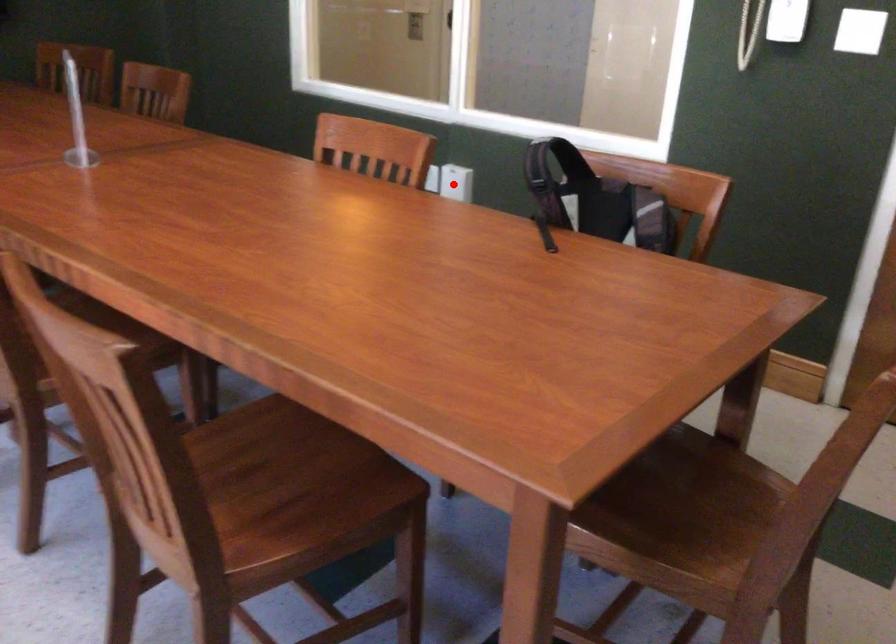
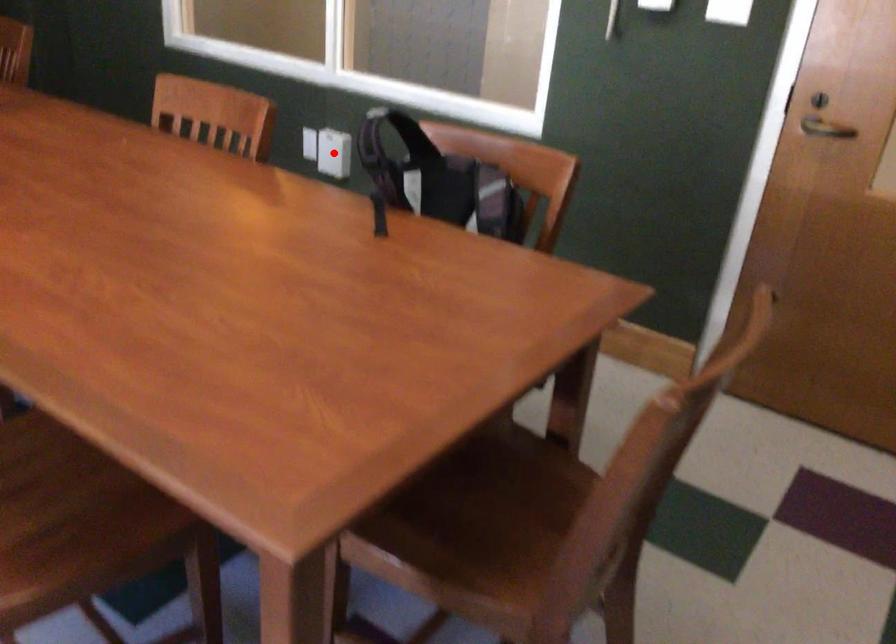
I am providing you with two images of the same scene from different viewpoints. A red point is marked on the first image and another point is marked on the second image. Is the marked point in image1 the same physical position as the marked point in image2?

Yes